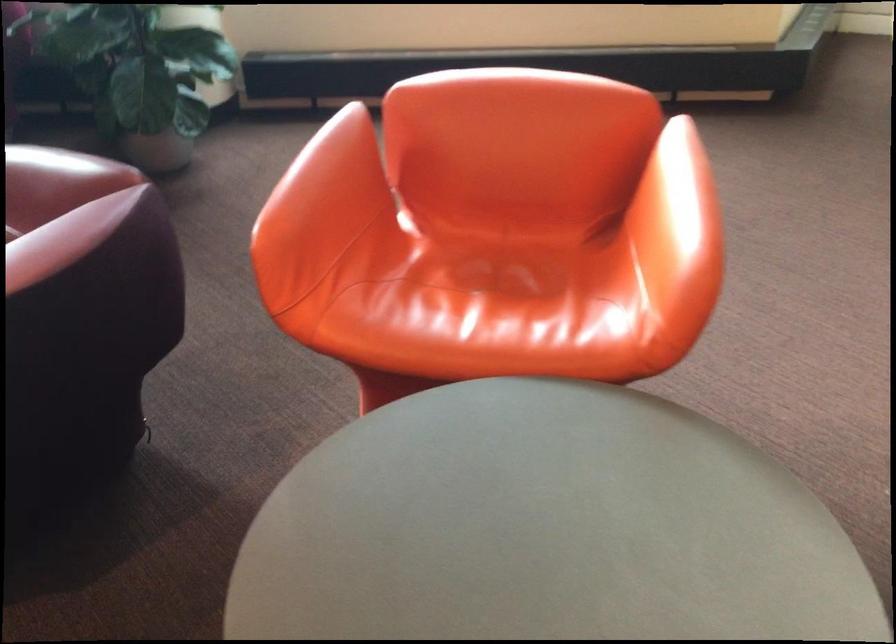
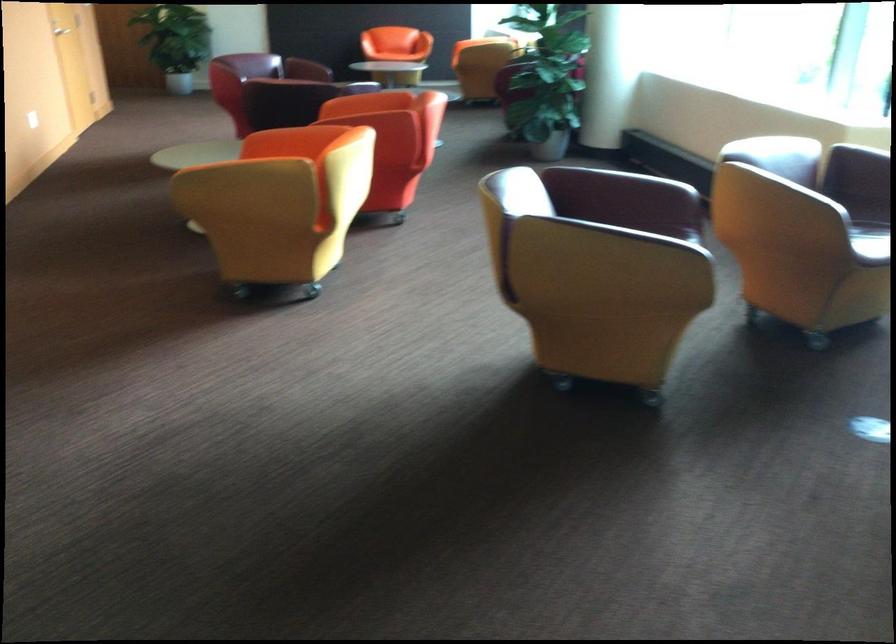
Question: I am providing you with two images of the same scene from different viewpoints. After the viewpoint changes to image2, which objects are now occluded?

Choices:
 (A) orange chair sitting surface
 (B) yellow chair armrest
 (C) dark chair seat
 (D) purple chair sitting surface

Answer: (A)